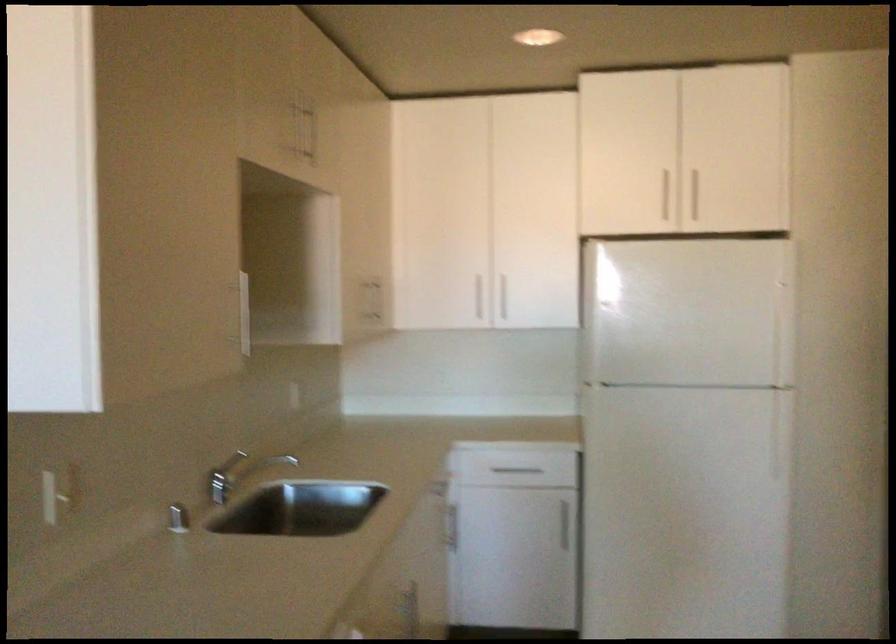
Find where to pull the refrigerator main door. Please return your answer as a coordinate pair (x, y).

(687, 313)